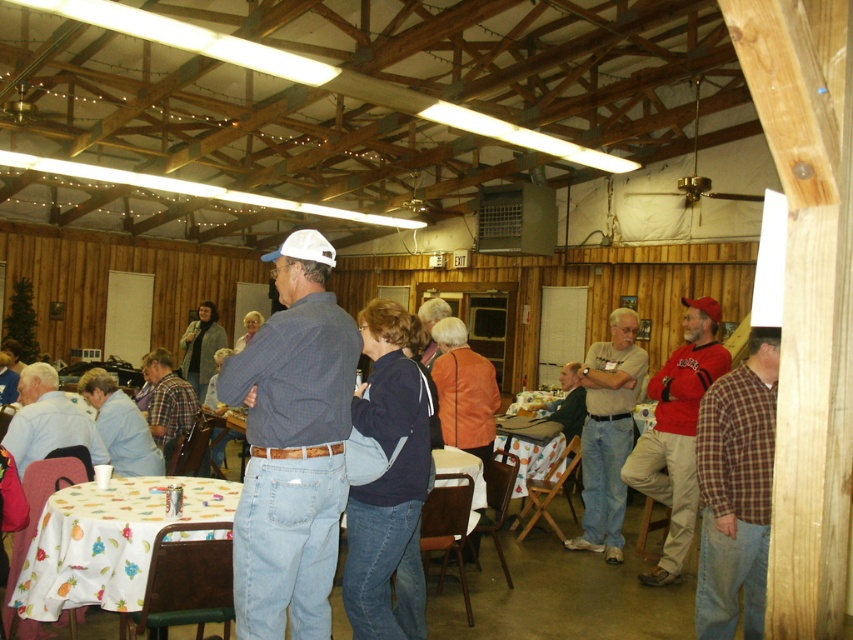
Is point (746, 525) positioned before point (151, 400)?

Yes, it is.

What do you see at coordinates (735, 490) in the screenshot? The image size is (853, 640). I see `plaid shirt at right` at bounding box center [735, 490].

Locate an element on the screen. plaid shirt at right is located at coordinates (735, 490).

Who is taller, light brown shirt at center or denim jeans at center?

With more height is light brown shirt at center.

What do you see at coordinates (608, 433) in the screenshot? The image size is (853, 640). I see `light brown shirt at center` at bounding box center [608, 433].

I want to click on light brown shirt at center, so click(x=608, y=433).

Can you confirm if dark blue plaid shirt at center is positioned to the right of white fabric table at lower left?

Correct, you'll find dark blue plaid shirt at center to the right of white fabric table at lower left.

Consider the image. Between dark blue plaid shirt at center and white fabric table at lower left, which one appears on the right side from the viewer's perspective?

Positioned to the right is dark blue plaid shirt at center.

Is point (318, 589) farther from camera compared to point (137, 570)?

No, it is not.

Find the location of a particular element. This screenshot has width=853, height=640. dark blue plaid shirt at center is located at coordinates (292, 448).